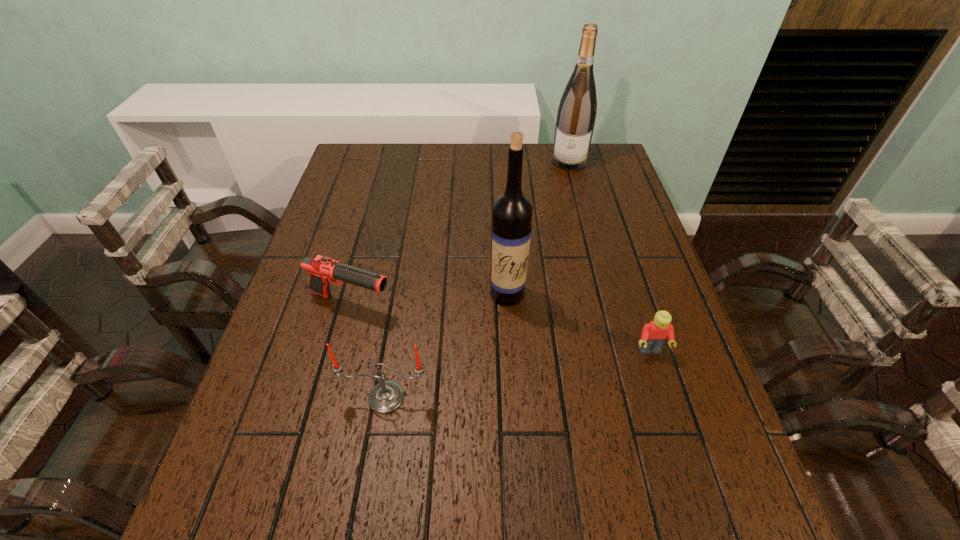
You are a GUI agent. You are given a task and a screenshot of the screen. Output one action in this format:
    pyautogui.click(x=<x>, y=<y>)
    Task: Click on the third closest object to the gun
    Image resolution: width=960 pixels, height=540 pixels.
    Given the screenshot: What is the action you would take?
    pyautogui.click(x=654, y=335)

Point out which object is positioned as the fourth nearest to the left wine bottle. Please provide its 2D coordinates. Your answer should be formatted as a tuple, i.e. [(x, y)], where the tuple contains the x and y coordinates of a point satisfying the conditions above.

[(576, 115)]

Find the location of a particular element. The image size is (960, 540). free point that satisfies the following two spatial constraints: 1. on the back side of the right wine bottle; 2. on the right side of the nearer wine bottle is located at coordinates (500, 161).